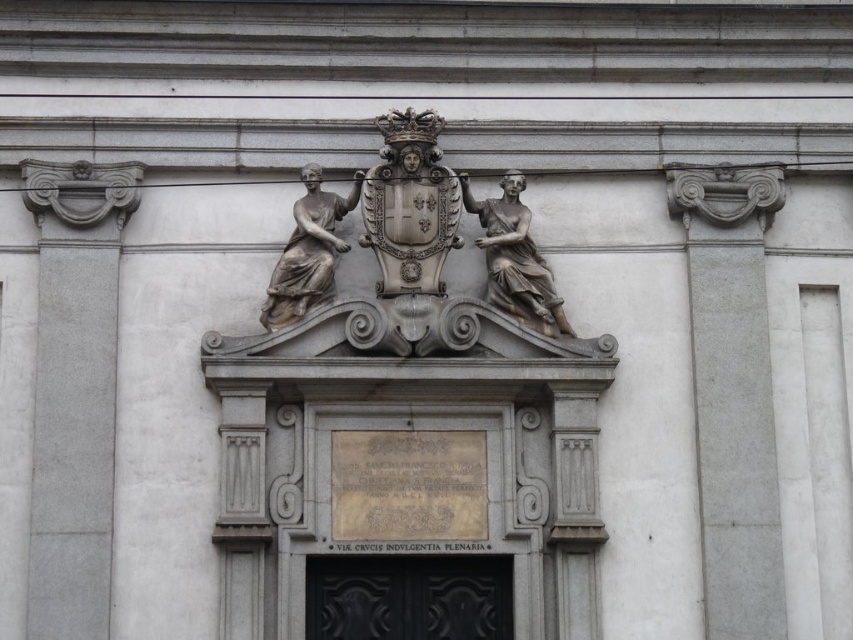
You are an architect examining the building facade. You notice two points marked on the pediment. The first point is at coordinates point (70, 291) and the second is at point (300, 284). From your vantage point, which point is closer to you?

Point (300, 284) is closer to you because point (70, 291) is behind it.